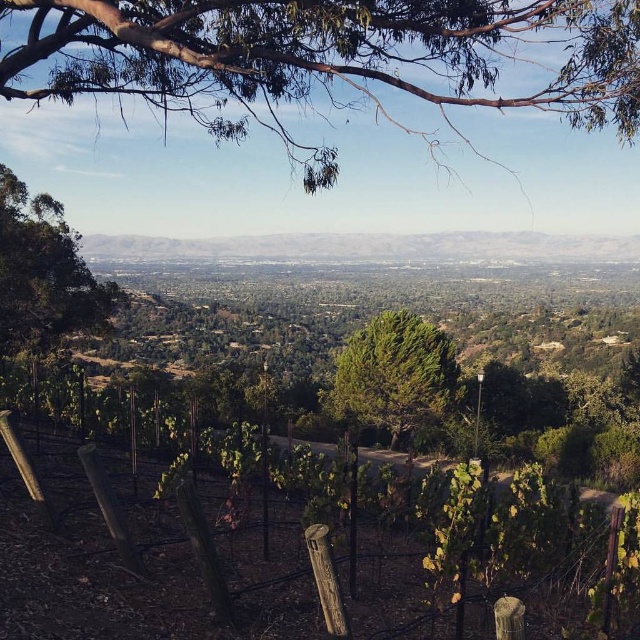
You are standing at the point with coordinates point [16,259] and want to walk towards the point with coordinates point [209,38]. According to the image, will you have to walk through the vineyard area?

Yes, you will have to walk through the vineyard area because point [209,38] is in front of point [16,259], meaning it is closer to the foreground where the vineyard is located.

You are a hiker planning to take a photo of the vineyard from the path. You want to ensure the green leafy branches at upper center and the green textured tree at center are both visible in your shot. Which object should you position closer to the top of the frame?

The green leafy branches at upper center should be positioned closer to the top of the frame since they are much taller than the green textured tree at center.